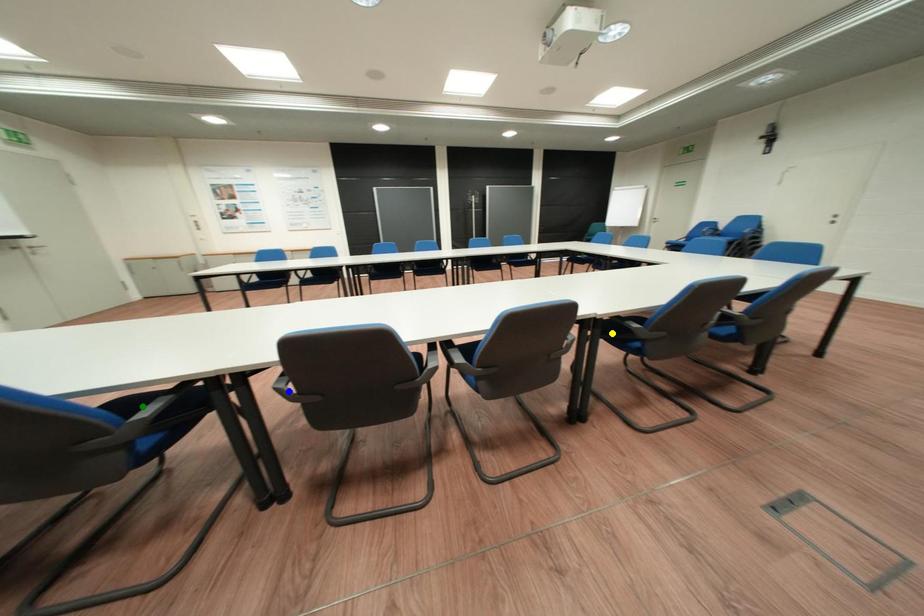
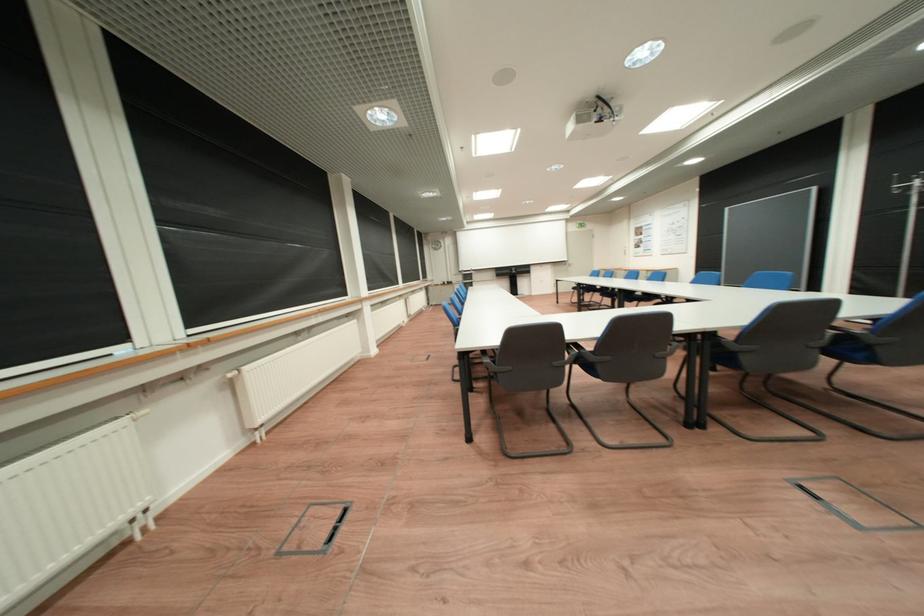
I am providing you with two images of the same scene from different viewpoints. Three points are marked in image1. Which point corresponds to a part or object that is occluded in image2?In image1, three points are marked. Which of them correspond to a part or object that is occluded in image2?Among the three points shown in image1, which one corresponds to a part or object that is no longer visible due to occlusion in image2?

blue point, yellow point, green point